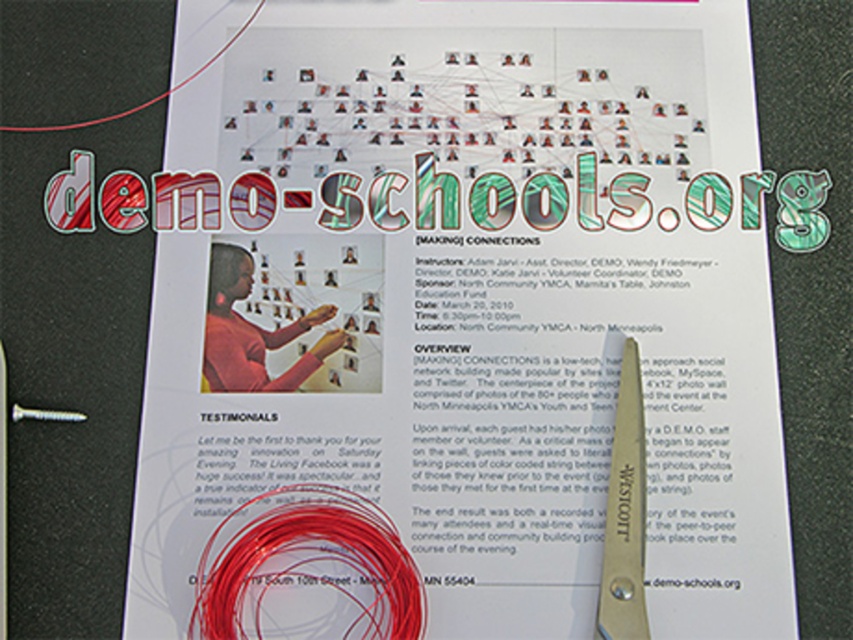
Question: Which point is farther to the camera?

Choices:
 (A) red string at center
 (B) silver metallic scissors at lower right

Answer: (B)

Question: Does red string at center appear under silver metallic scissors at lower right?

Choices:
 (A) yes
 (B) no

Answer: (A)

Question: Which of the following is the closest to the observer?

Choices:
 (A) silver metallic scissors at lower right
 (B) red string at center

Answer: (B)

Question: Which of the following is the farthest from the observer?

Choices:
 (A) (619, 509)
 (B) (225, 566)

Answer: (A)

Question: Does red string at center appear under silver metallic scissors at lower right?

Choices:
 (A) yes
 (B) no

Answer: (A)

Question: Considering the relative positions of red string at center and silver metallic scissors at lower right in the image provided, where is red string at center located with respect to silver metallic scissors at lower right?

Choices:
 (A) below
 (B) above

Answer: (A)